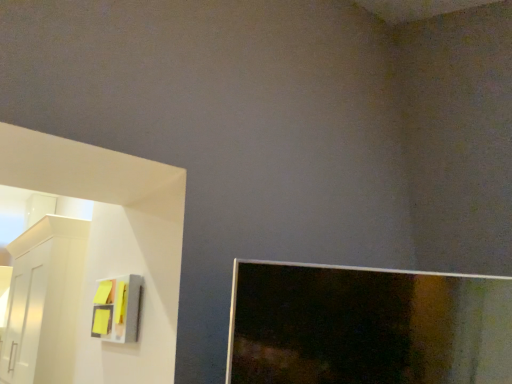
Describe the element at coordinates (117, 309) in the screenshot. I see `yellow sticky notes at left` at that location.

Where is `yellow sticky notes at left`? The width and height of the screenshot is (512, 384). yellow sticky notes at left is located at coordinates (117, 309).

This screenshot has width=512, height=384. What do you see at coordinates (44, 301) in the screenshot?
I see `white glossy cabinet at left` at bounding box center [44, 301].

Locate an element on the screen. white glossy cabinet at left is located at coordinates (44, 301).

Image resolution: width=512 pixels, height=384 pixels. Find the location of `yellow sticky notes at left`. yellow sticky notes at left is located at coordinates (117, 309).

Is yellow sticky notes at left to the right of white glossy cabinet at left from the viewer's perspective?

Correct, you'll find yellow sticky notes at left to the right of white glossy cabinet at left.

Consider the image. Which object is further away from the camera, yellow sticky notes at left or white glossy cabinet at left?

white glossy cabinet at left is further away from the camera.

Is point (106, 286) closer to camera compared to point (52, 276)?

That is True.

From the image's perspective, between yellow sticky notes at left and white glossy cabinet at left, who is located below?

white glossy cabinet at left is shown below in the image.

Consider the image. From a real-world perspective, relative to white glossy cabinet at left, is yellow sticky notes at left vertically above or below?

In terms of real-world spatial position, yellow sticky notes at left is below white glossy cabinet at left.

In terms of width, does yellow sticky notes at left look wider or thinner when compared to white glossy cabinet at left?

yellow sticky notes at left is thinner than white glossy cabinet at left.

Who is shorter, yellow sticky notes at left or white glossy cabinet at left?

yellow sticky notes at left is shorter.

Who is smaller, yellow sticky notes at left or white glossy cabinet at left?

yellow sticky notes at left is smaller.

Can white glossy cabinet at left be found inside yellow sticky notes at left?

No, white glossy cabinet at left is not a part of yellow sticky notes at left.

Looking at this image, is yellow sticky notes at left next to white glossy cabinet at left and touching it?

There is a gap between yellow sticky notes at left and white glossy cabinet at left.

Is yellow sticky notes at left facing towards white glossy cabinet at left?

No, yellow sticky notes at left is not oriented towards white glossy cabinet at left.

Can you tell me how much yellow sticky notes at left and white glossy cabinet at left differ in facing direction?

yellow sticky notes at left and white glossy cabinet at left are facing 2.26 degrees away from each other.

You are a GUI agent. You are given a task and a screenshot of the screen. Output one action in this format:
    pyautogui.click(x=<x>, y=<y>)
    Task: Click on the cabinet in front of the white glossy cabinet at left
    This screenshot has height=384, width=512.
    Given the screenshot: What is the action you would take?
    pyautogui.click(x=117, y=309)

Looking at this image, is white glossy cabinet at left at the left side of yellow sticky notes at left?

Yes.

Which object is closer to the camera taking this photo, white glossy cabinet at left or yellow sticky notes at left?

yellow sticky notes at left is more forward.

Considering the positions of point (60, 222) and point (112, 310), is point (60, 222) closer or farther from the camera than point (112, 310)?

Point (60, 222) is positioned farther from the camera compared to point (112, 310).

From the image's perspective, is white glossy cabinet at left located beneath yellow sticky notes at left?

Yes.

From a real-world perspective, is white glossy cabinet at left above or below yellow sticky notes at left?

white glossy cabinet at left is situated higher than yellow sticky notes at left in the real world.

Which of these two, white glossy cabinet at left or yellow sticky notes at left, is thinner?

With smaller width is yellow sticky notes at left.

Between white glossy cabinet at left and yellow sticky notes at left, which one has less height?

yellow sticky notes at left is shorter.

Is white glossy cabinet at left smaller than yellow sticky notes at left?

Actually, white glossy cabinet at left might be larger than yellow sticky notes at left.

Looking at this image, is white glossy cabinet at left located outside yellow sticky notes at left?

Indeed, white glossy cabinet at left is completely outside yellow sticky notes at left.

Is white glossy cabinet at left not close to yellow sticky notes at left?

No, there isn't a large distance between white glossy cabinet at left and yellow sticky notes at left.

Is white glossy cabinet at left oriented away from yellow sticky notes at left?

That's not correct — white glossy cabinet at left is not looking away from yellow sticky notes at left.

Measure the distance from white glossy cabinet at left to yellow sticky notes at left.

white glossy cabinet at left is 34.14 inches from yellow sticky notes at left.

There is a yellow sticky notes at left. What are the coordinates of `furniture above it (from a real-world perspective)` in the screenshot? It's located at (44, 301).

At what (x,y) coordinates should I click in order to perform the action: click on furniture below the yellow sticky notes at left (from the image's perspective). Please return your answer as a coordinate pair (x, y). Image resolution: width=512 pixels, height=384 pixels. Looking at the image, I should click on (44, 301).

In order to click on furniture that is on the left side of yellow sticky notes at left in this screenshot , I will do `click(44, 301)`.